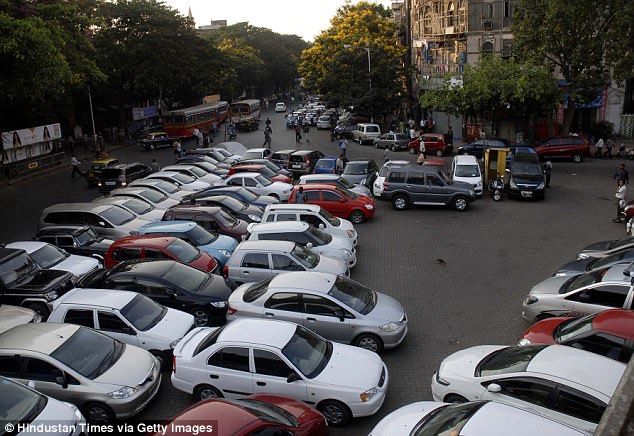
The image size is (634, 436). I want to click on door handles, so click(x=212, y=374), click(x=262, y=383), click(x=271, y=316), click(x=313, y=318), click(x=246, y=272), click(x=425, y=184), click(x=406, y=183).